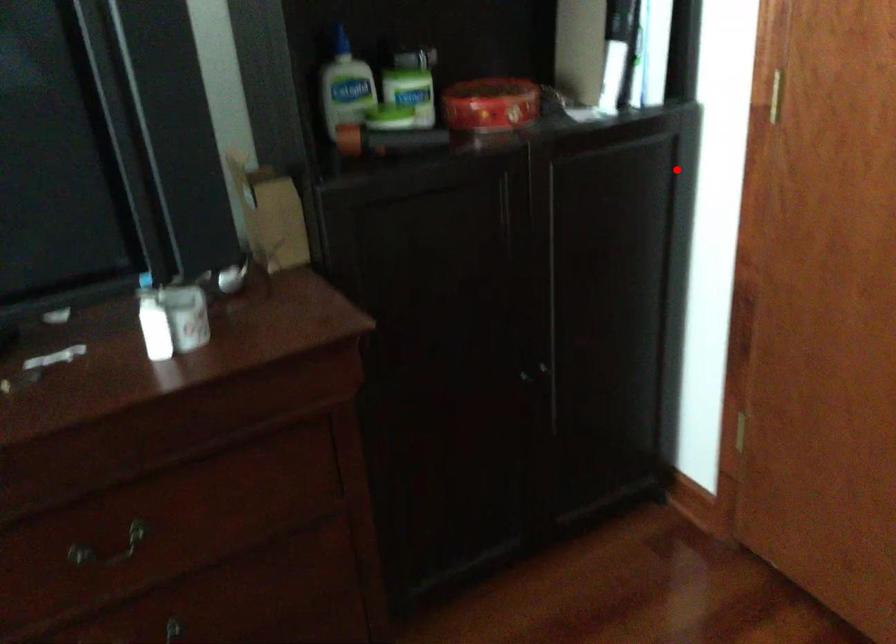
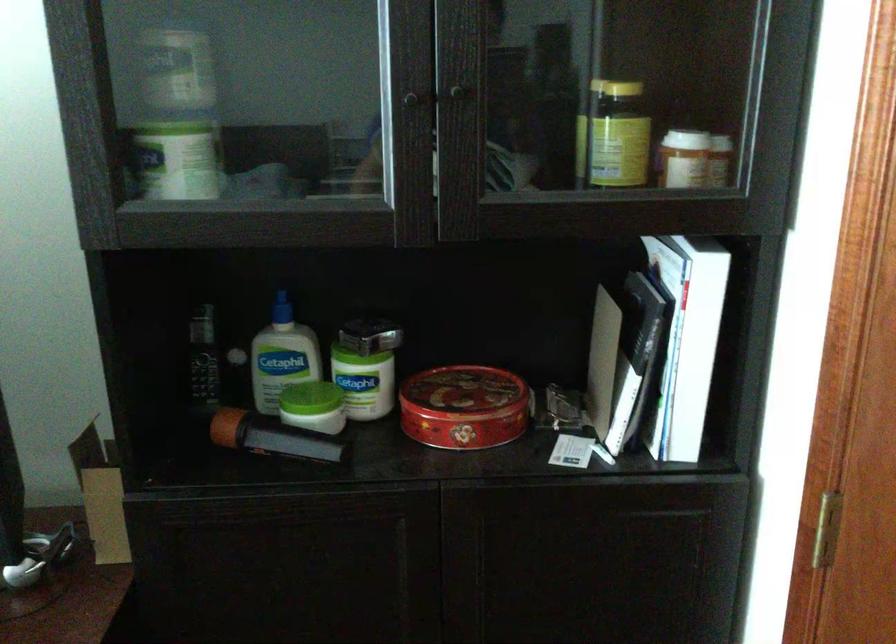
Question: A red point is marked in image1. In image2, is the corresponding 3D point closer to the camera or farther? Reply with the corresponding letter.

Choices:
 (A) The corresponding 3D point is closer.
 (B) The corresponding 3D point is farther.

Answer: (A)